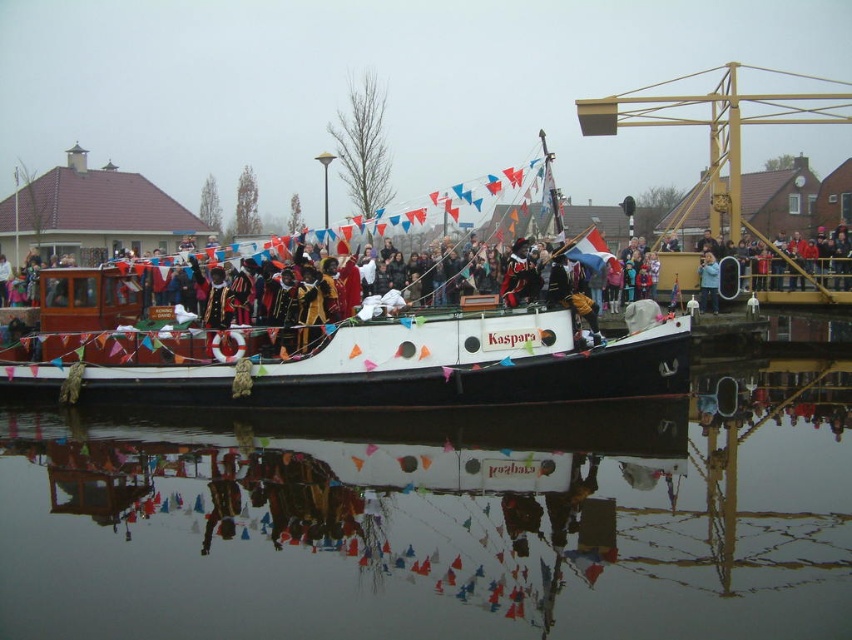
Is point (728, 413) behind point (704, 298)?

No, (728, 413) is closer to viewer.

Describe the element at coordinates (441, 525) in the screenshot. The width and height of the screenshot is (852, 640). I see `transparent water at center` at that location.

You are a GUI agent. You are given a task and a screenshot of the screen. Output one action in this format:
    pyautogui.click(x=<x>, y=<y>)
    Task: Click on the transparent water at center
    Image resolution: width=852 pixels, height=640 pixels.
    Given the screenshot: What is the action you would take?
    pyautogui.click(x=441, y=525)

Can you confirm if white matte boat at center is smaller than blue fabric jacket at center?

Actually, white matte boat at center might be larger than blue fabric jacket at center.

Can you confirm if white matte boat at center is positioned to the right of blue fabric jacket at center?

Incorrect, white matte boat at center is not on the right side of blue fabric jacket at center.

Find the location of `white matte boat at center`. white matte boat at center is located at coordinates (332, 353).

Is transparent water at center taller than white matte boat at center?

No, transparent water at center is not taller than white matte boat at center.

In the scene shown: Between transparent water at center and white matte boat at center, which one is positioned lower?

transparent water at center

The width and height of the screenshot is (852, 640). I want to click on transparent water at center, so click(441, 525).